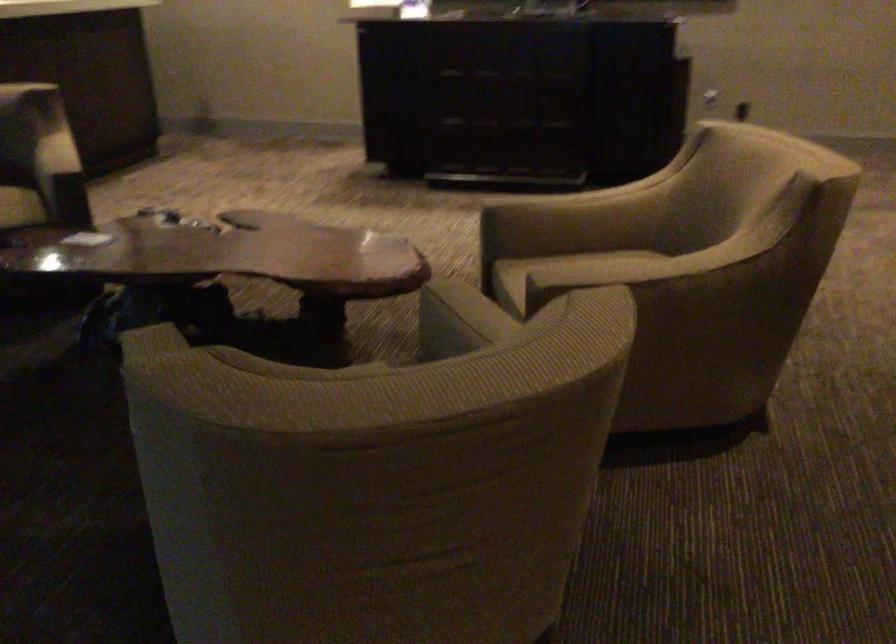
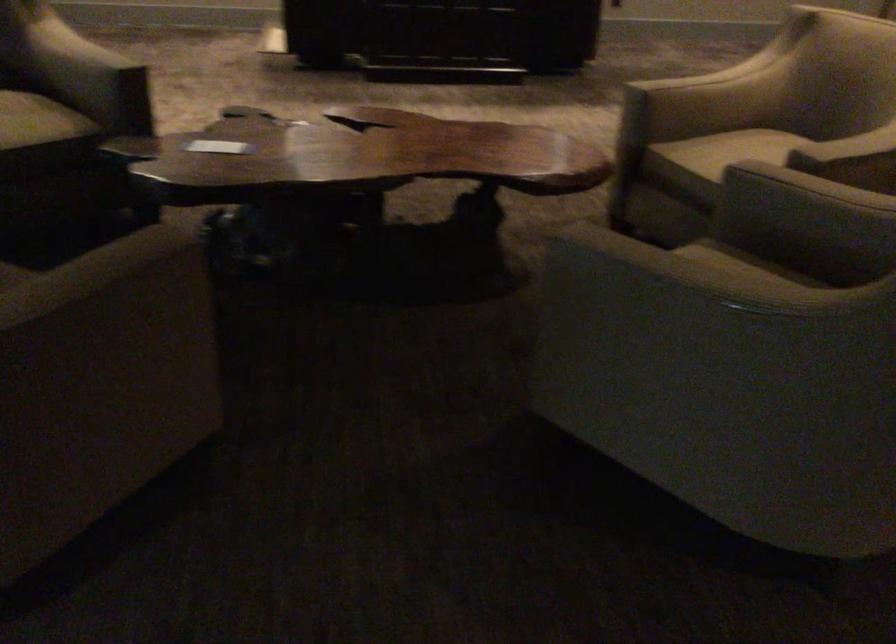
Where in the second image is the point corresponding to (x=435, y=333) from the first image?

(806, 207)